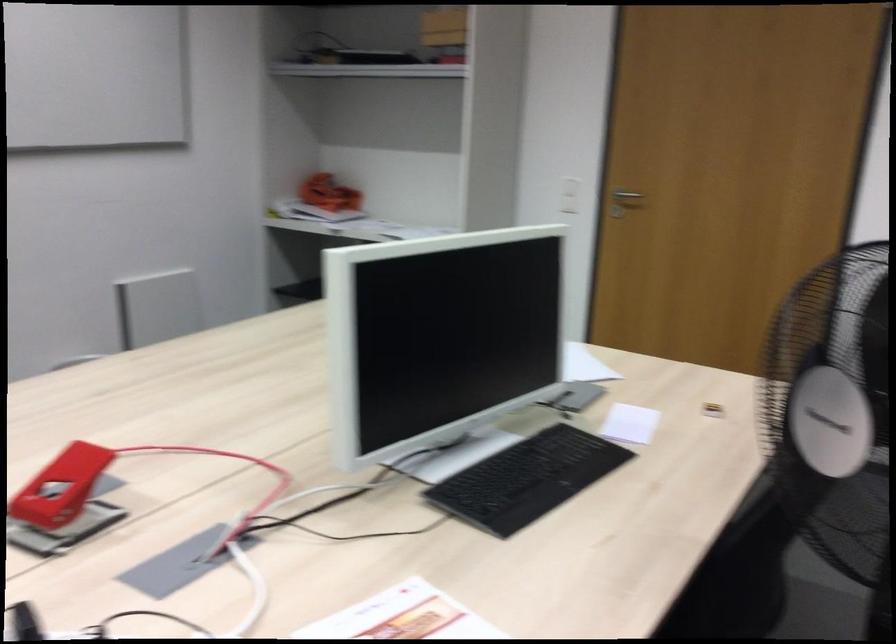
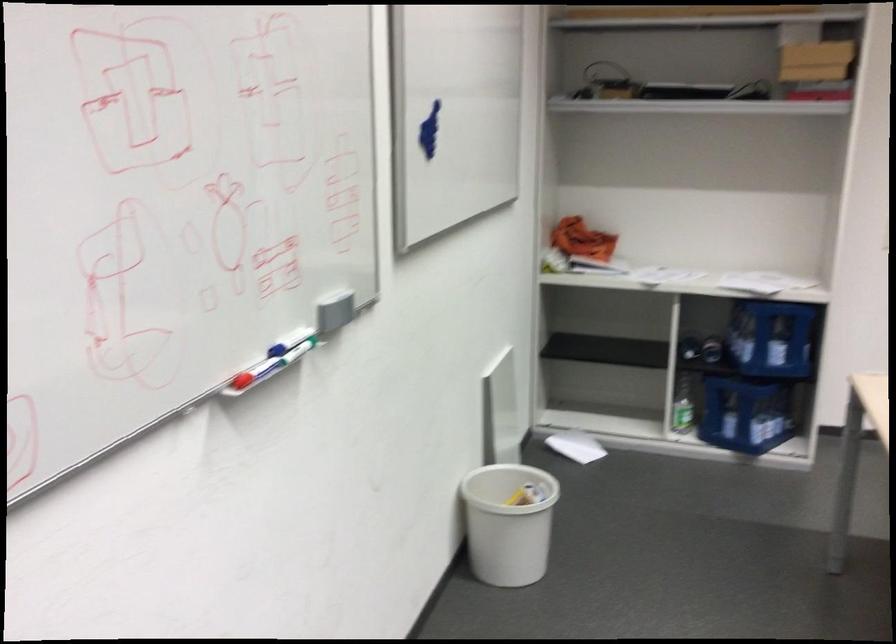
Question: I am providing you with two images of the same scene from different viewpoints. Please identify which objects are invisible in image2.

Choices:
 (A) green glass bottle
 (B) leaning picture frame
 (C) small yellow box
 (D) white paper sheet

Answer: (C)